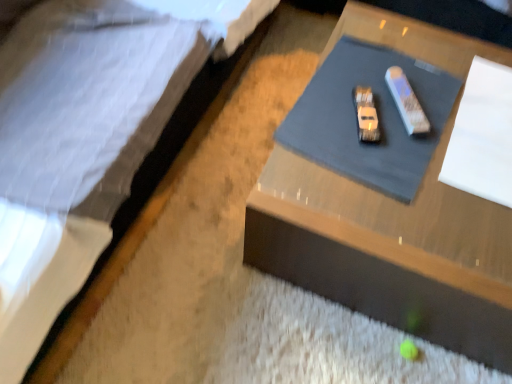
Question: From the image's perspective, is wooden table at center over white quilted fabric at upper left?

Choices:
 (A) no
 (B) yes

Answer: (A)

Question: Does wooden table at center have a smaller size compared to white quilted fabric at upper left?

Choices:
 (A) no
 (B) yes

Answer: (B)

Question: From the image's perspective, does wooden table at center appear lower than white quilted fabric at upper left?

Choices:
 (A) no
 (B) yes

Answer: (B)

Question: Is wooden table at center turned away from white quilted fabric at upper left?

Choices:
 (A) no
 (B) yes

Answer: (A)

Question: Is wooden table at center closer to camera compared to white quilted fabric at upper left?

Choices:
 (A) no
 (B) yes

Answer: (A)

Question: Considering their positions, is wooden table at center located in front of or behind white quilted fabric at upper left?

Choices:
 (A) front
 (B) behind

Answer: (B)

Question: Is wooden table at center inside or outside of white quilted fabric at upper left?

Choices:
 (A) outside
 (B) inside

Answer: (A)

Question: From a real-world perspective, is wooden table at center positioned above or below white quilted fabric at upper left?

Choices:
 (A) below
 (B) above

Answer: (A)

Question: Considering the positions of wooden table at center and white quilted fabric at upper left in the image, is wooden table at center bigger or smaller than white quilted fabric at upper left?

Choices:
 (A) big
 (B) small

Answer: (B)

Question: Is white paper at upper right spatially inside white quilted fabric at upper left, or outside of it?

Choices:
 (A) inside
 (B) outside

Answer: (B)

Question: From a real-world perspective, is white paper at upper right positioned above or below white quilted fabric at upper left?

Choices:
 (A) below
 (B) above

Answer: (A)

Question: Is white paper at upper right in front of or behind white quilted fabric at upper left in the image?

Choices:
 (A) behind
 (B) front

Answer: (A)

Question: Is white paper at upper right taller or shorter than white quilted fabric at upper left?

Choices:
 (A) tall
 (B) short

Answer: (B)

Question: Based on their sizes in the image, would you say white quilted fabric at upper left is bigger or smaller than wooden table at center?

Choices:
 (A) small
 (B) big

Answer: (B)

Question: From a real-world perspective, relative to wooden table at center, is white quilted fabric at upper left vertically above or below?

Choices:
 (A) above
 (B) below

Answer: (A)